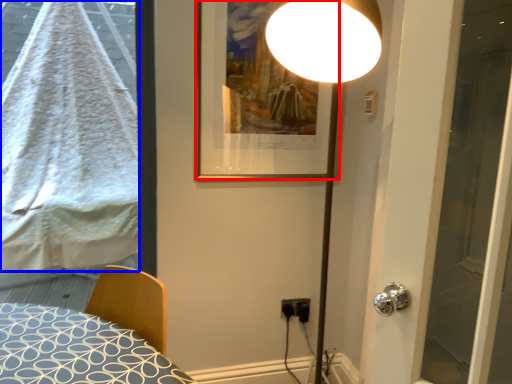
Question: Among these objects, which one is nearest to the camera, picture frame (highlighted by a red box) or blanket (highlighted by a blue box)?

Choices:
 (A) picture frame
 (B) blanket

Answer: (A)